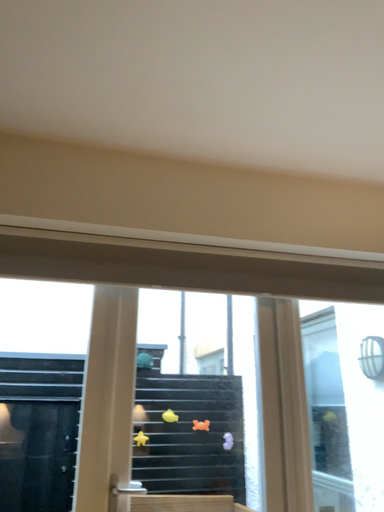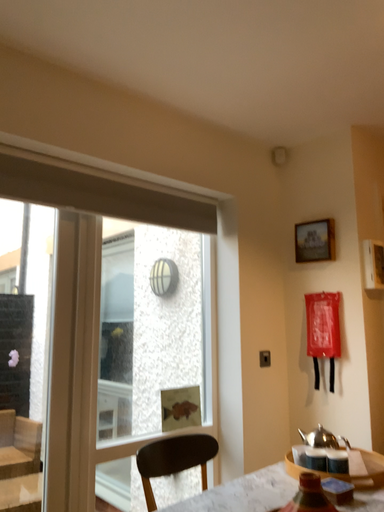
Question: How did the camera likely rotate when shooting the video?

Choices:
 (A) rotated downward
 (B) rotated upward

Answer: (A)